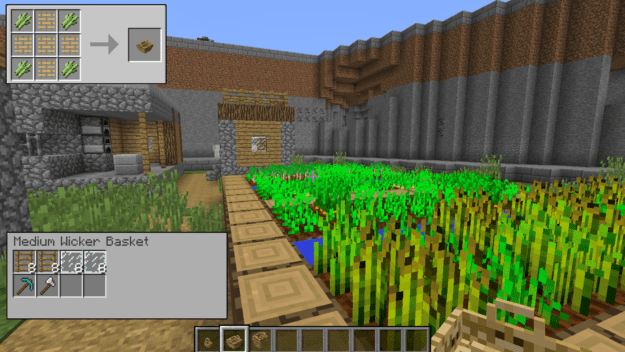
Locate an element on the screen. wicker is located at coordinates point(75,240).